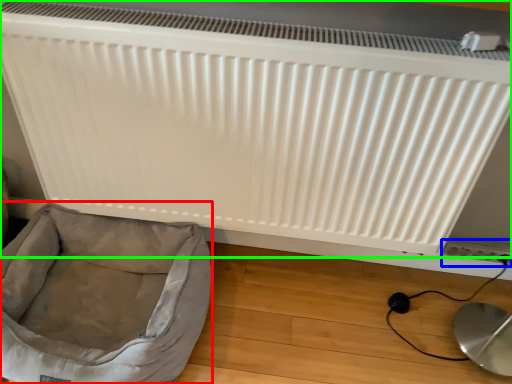
Question: Which is farther away from dog bed (highlighted by a red box)? electric outlet (highlighted by a blue box) or radiator (highlighted by a green box)?

Choices:
 (A) electric outlet
 (B) radiator

Answer: (A)